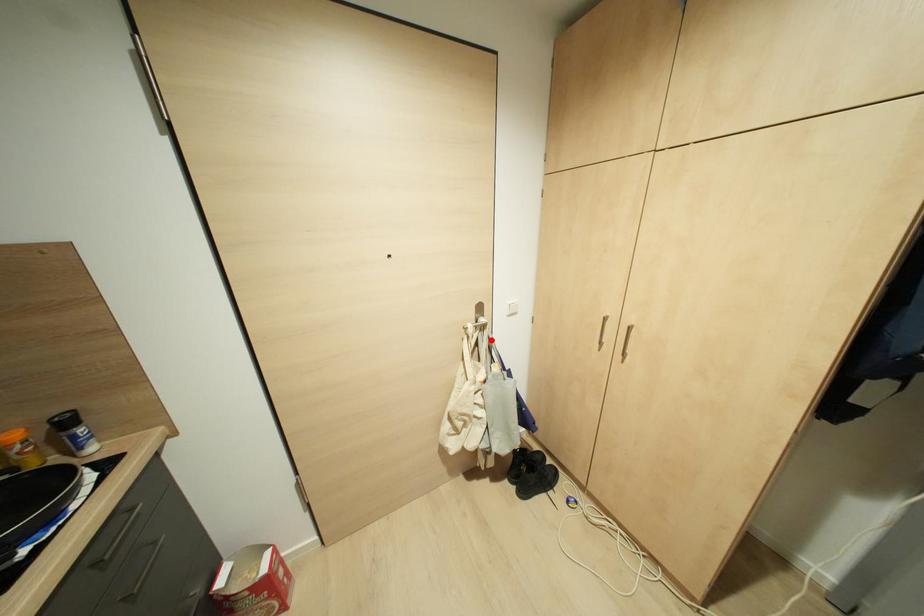
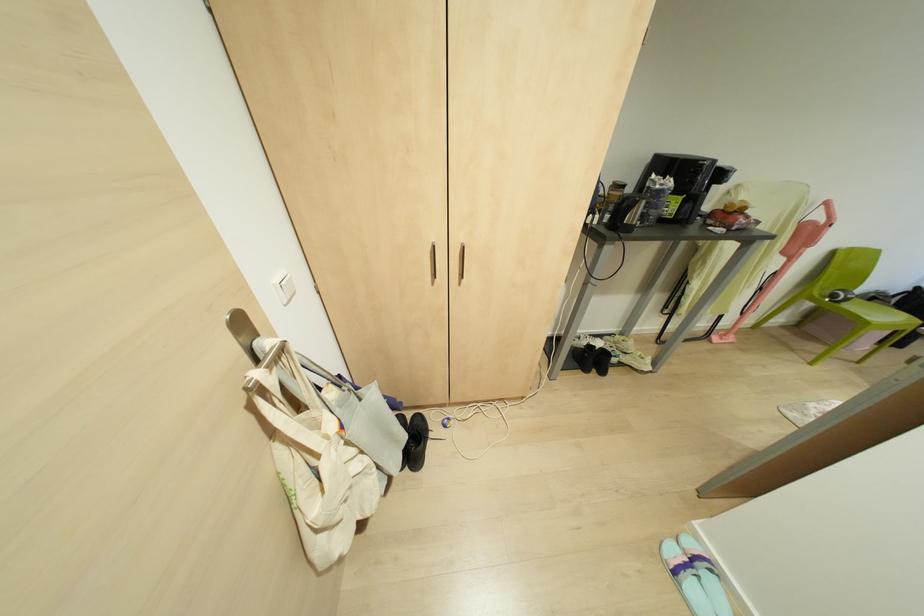
Question: I am providing you with two images of the same scene from different viewpoints. A red point is marked on the first image. Is the red point's position out of view in image 2?

Choices:
 (A) Yes
 (B) No

Answer: (B)